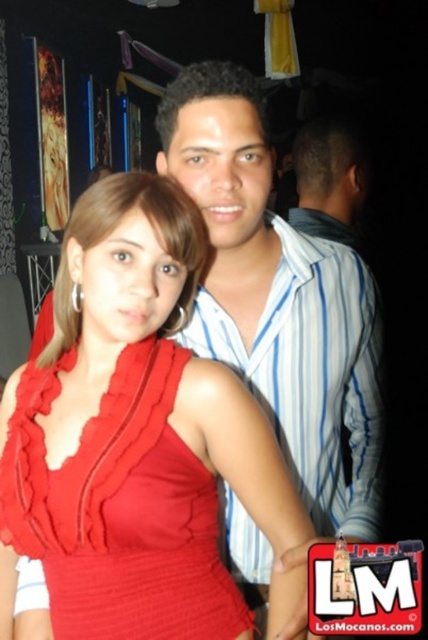
You are a photographer at a party and want to ensure both the red satin dress at center and the striped cotton shirt at upper center are visible in the photo. Which clothing item should you adjust your focus on to ensure both are in frame?

The striped cotton shirt at upper center is taller than the red satin dress at center, so you should focus on the striped cotton shirt at upper center to ensure both are in frame.

You are a photographer adjusting the framing for a group photo. The scene includes a red satin dress at center and a striped cotton shirt at upper center. Which clothing item requires more horizontal space in the frame to avoid being cut off?

The red satin dress at center requires more horizontal space in the frame because its width is larger than the striped cotton shirt at upper center.

You are organizing a photo shoot and need to ensure that the red satin dress at center and the matte blue shirt at center are visible in the frame. Given that the camera has a fixed focal length, which of the two items might require adjustment to ensure proper framing?

The red satin dress at center is smaller than the matte blue shirt at center, so it might require less adjustment to ensure proper framing since it occupies less space in the frame.